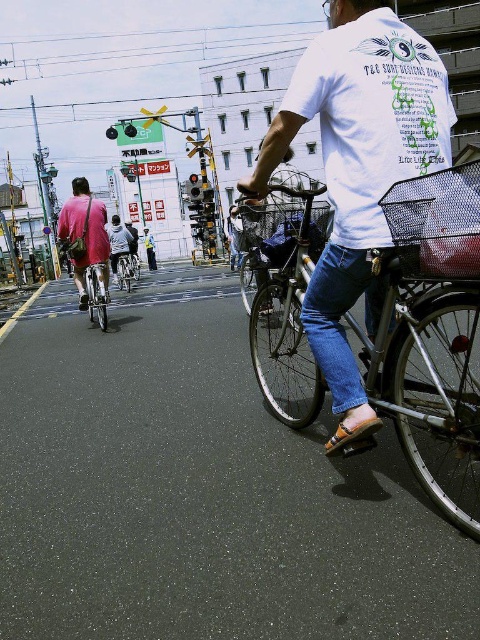
Between white cotton t-shirt at center and metallic mesh basket at center, which one is positioned higher?

white cotton t-shirt at center is higher up.

Can you confirm if white cotton t-shirt at center is shorter than metallic mesh basket at center?

In fact, white cotton t-shirt at center may be taller than metallic mesh basket at center.

Is point (442, 93) more distant than point (444, 243)?

Yes, it is behind point (444, 243).

Image resolution: width=480 pixels, height=640 pixels. I want to click on white cotton t-shirt at center, so click(359, 170).

Can you confirm if metallic mesh basket at center is taller than light blue jeans at center?

No.

Is point (453, 188) farther from camera compared to point (145, 252)?

No, (453, 188) is closer to viewer.

Which is behind, point (414, 218) or point (146, 252)?

The point (146, 252) is behind.

You are a GUI agent. You are given a task and a screenshot of the screen. Output one action in this format:
    pyautogui.click(x=<x>, y=<y>)
    Task: Click on the metallic mesh basket at center
    
    Given the screenshot: What is the action you would take?
    pyautogui.click(x=436, y=221)

Does metallic silver bicycle at center have a lesser height compared to light gray fabric jacket at center?

Yes, metallic silver bicycle at center is shorter than light gray fabric jacket at center.

Does metallic silver bicycle at center have a smaller size compared to light gray fabric jacket at center?

Correct, metallic silver bicycle at center occupies less space than light gray fabric jacket at center.

The width and height of the screenshot is (480, 640). What do you see at coordinates (429, 323) in the screenshot?
I see `metallic silver bicycle at center` at bounding box center [429, 323].

Image resolution: width=480 pixels, height=640 pixels. In order to click on metallic silver bicycle at center in this screenshot , I will do `click(429, 323)`.